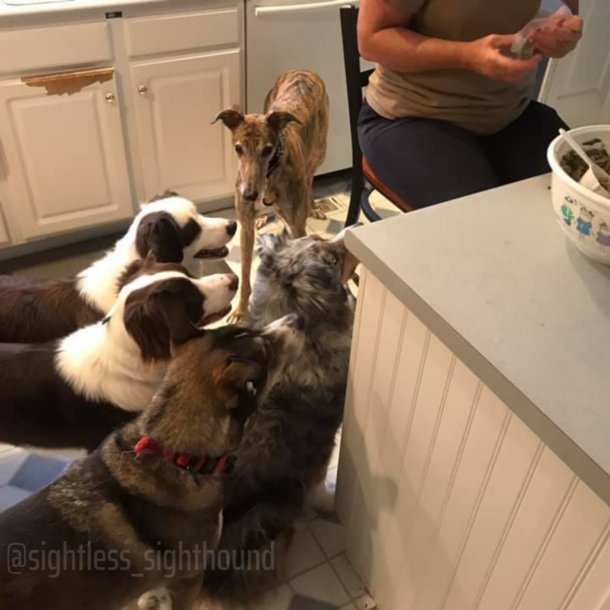
I want to click on light gray counter top, so click(512, 284).